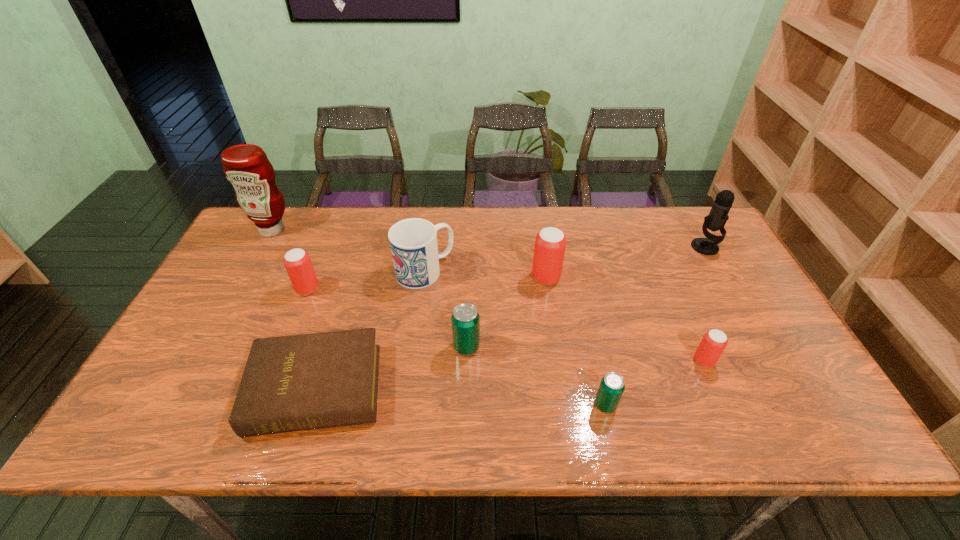
Locate an element on the screen. Image resolution: width=960 pixels, height=540 pixels. vacant space located on the left of the mug is located at coordinates (366, 271).

The width and height of the screenshot is (960, 540). I want to click on vacant area located on the right of the second biggest red beer can, so click(372, 289).

At what (x,y) coordinates should I click in order to perform the action: click on vacant space located 0.200m on the front of the left teal beer can. Please return your answer as a coordinate pair (x, y). This screenshot has height=540, width=960. Looking at the image, I should click on (464, 434).

You are a GUI agent. You are given a task and a screenshot of the screen. Output one action in this format:
    pyautogui.click(x=<x>, y=<y>)
    Task: Click on the free space located 0.090m on the back of the rightmost red beer can
    This screenshot has height=540, width=960.
    Given the screenshot: What is the action you would take?
    pyautogui.click(x=688, y=325)

I want to click on blank space located on the right of the smaller teal beer can, so click(x=775, y=405).

Where is `free space located on the back of the Bible`? Image resolution: width=960 pixels, height=540 pixels. free space located on the back of the Bible is located at coordinates (360, 245).

At what (x,y) coordinates should I click in order to perform the action: click on condiment that is at the far edge. Please return your answer as a coordinate pair (x, y). This screenshot has width=960, height=540. Looking at the image, I should click on (246, 166).

Locate an element on the screen. The height and width of the screenshot is (540, 960). microphone that is at the far edge is located at coordinates (718, 216).

The image size is (960, 540). I want to click on beer can that is at the near edge, so click(612, 385).

What are the coordinates of `Bible located at the near edge` in the screenshot? It's located at (292, 383).